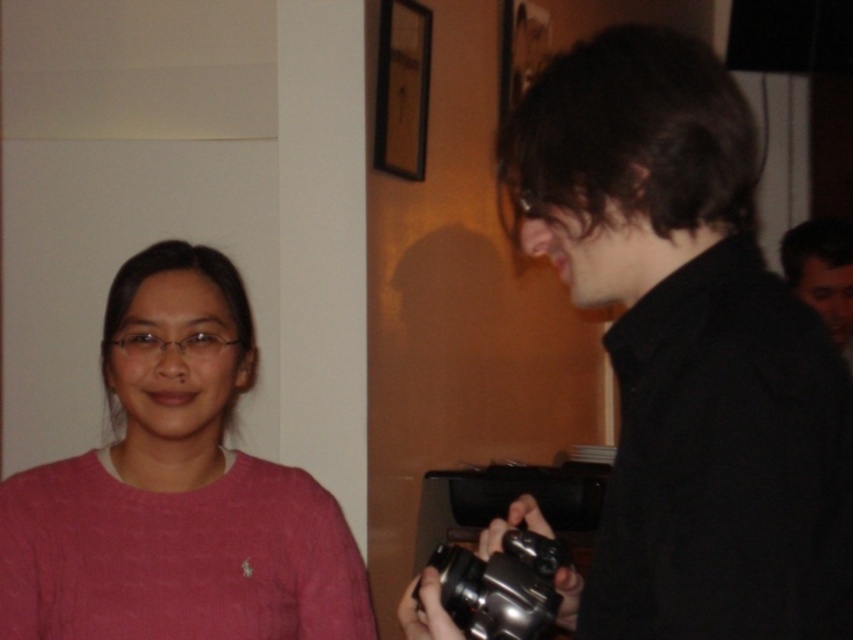
Question: Which is farther from the metallic silver camera at lower center?

Choices:
 (A) black matte camera at right
 (B) pink sweater at left

Answer: (B)

Question: Considering the real-world distances, which object is farthest from the metallic silver camera at lower center?

Choices:
 (A) black matte camera at right
 (B) dark brown hair at right
 (C) pink sweater at left

Answer: (B)

Question: Considering the relative positions of pink sweater at left and dark brown hair at right in the image provided, where is pink sweater at left located with respect to dark brown hair at right?

Choices:
 (A) below
 (B) above

Answer: (A)

Question: Estimate the real-world distances between objects in this image. Which object is closer to the black matte camera at right?

Choices:
 (A) pink sweater at left
 (B) metallic silver camera at lower center

Answer: (B)

Question: Is black matte camera at right below metallic silver camera at lower center?

Choices:
 (A) yes
 (B) no

Answer: (B)

Question: Is black matte camera at right to the right of dark brown hair at right from the viewer's perspective?

Choices:
 (A) yes
 (B) no

Answer: (B)